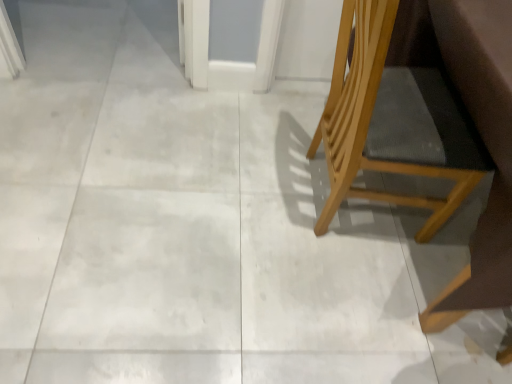
What do you see at coordinates (396, 111) in the screenshot? I see `light brown wood chair at right` at bounding box center [396, 111].

This screenshot has height=384, width=512. In order to click on light brown wood chair at right in this screenshot , I will do `click(396, 111)`.

Image resolution: width=512 pixels, height=384 pixels. Identify the location of light brown wood chair at right. (396, 111).